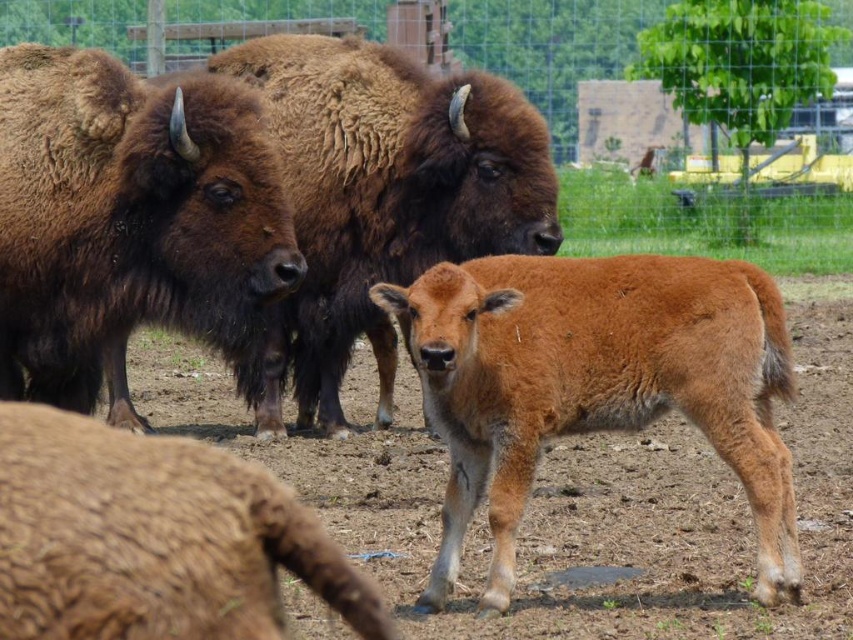
In the scene shown: Can you confirm if brown furry calf at center is wider than wire mesh fence at upper center?

Indeed, brown furry calf at center has a greater width compared to wire mesh fence at upper center.

Who is taller, brown furry calf at center or wire mesh fence at upper center?

brown furry calf at center

Is point (514, 452) closer to camera compared to point (819, 205)?

Yes, point (514, 452) is closer to viewer.

At what (x,y) coordinates should I click in order to perform the action: click on brown furry calf at center. Please return your answer as a coordinate pair (x, y). The image size is (853, 640). Looking at the image, I should click on (595, 381).

Can you confirm if brown furry bison at center is shorter than wire mesh fence at upper center?

Incorrect, brown furry bison at center's height does not fall short of wire mesh fence at upper center's.

How distant is brown furry bison at center from wire mesh fence at upper center?

A distance of 5.76 meters exists between brown furry bison at center and wire mesh fence at upper center.

The width and height of the screenshot is (853, 640). I want to click on brown furry bison at center, so click(384, 196).

Identify the location of brown furry bison at center. (384, 196).

Does brown fuzzy bison at upper left have a greater width compared to brown furry bison at center?

No, brown fuzzy bison at upper left is not wider than brown furry bison at center.

Is brown fuzzy bison at upper left behind brown furry bison at center?

That is False.

You are a GUI agent. You are given a task and a screenshot of the screen. Output one action in this format:
    pyautogui.click(x=<x>, y=<y>)
    Task: Click on the brown fuzzy bison at upper left
    
    Given the screenshot: What is the action you would take?
    pyautogui.click(x=126, y=216)